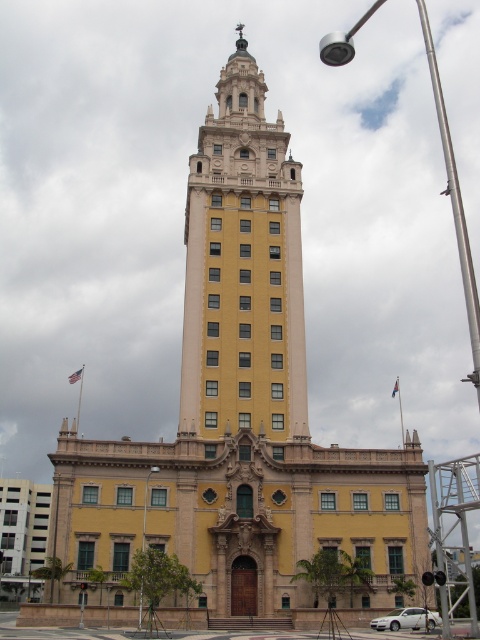
Question: Which object is the closest to the yellow stone tower at center?

Choices:
 (A) silver metallic pole at upper center
 (B) metallic pole at center

Answer: (A)

Question: Which object is farther from the camera taking this photo?

Choices:
 (A) silver metallic pole at upper center
 (B) metallic pole at center

Answer: (B)

Question: Is yellow stone tower at center positioned at the back of silver metallic pole at upper center?

Choices:
 (A) no
 (B) yes

Answer: (B)

Question: Does yellow stone tower at center have a smaller size compared to silver metallic pole at upper center?

Choices:
 (A) yes
 (B) no

Answer: (A)

Question: Which point is closer to the camera?

Choices:
 (A) (142, 541)
 (B) (237, 250)
 (C) (477, 339)

Answer: (C)

Question: Is yellow stone tower at center closer to camera compared to metallic pole at center?

Choices:
 (A) no
 (B) yes

Answer: (A)